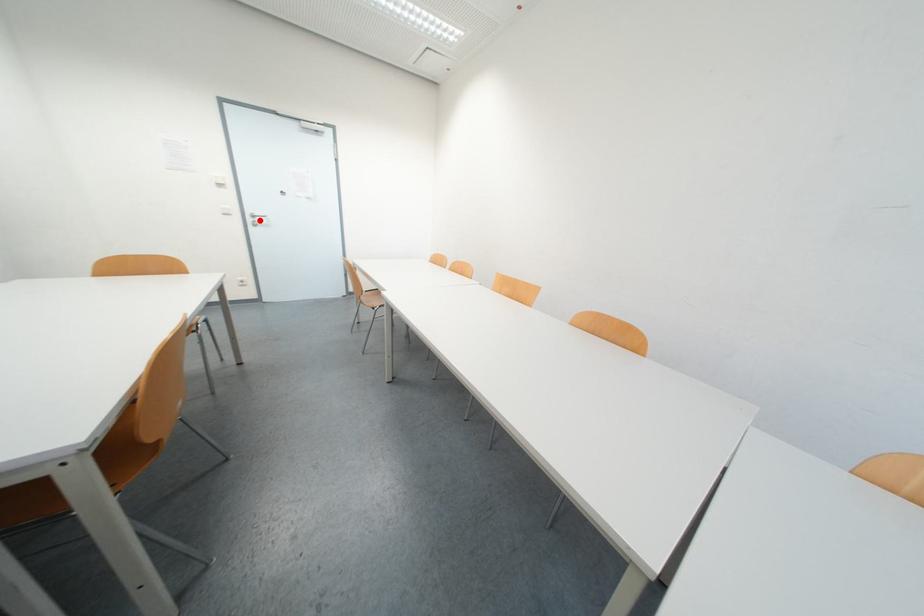
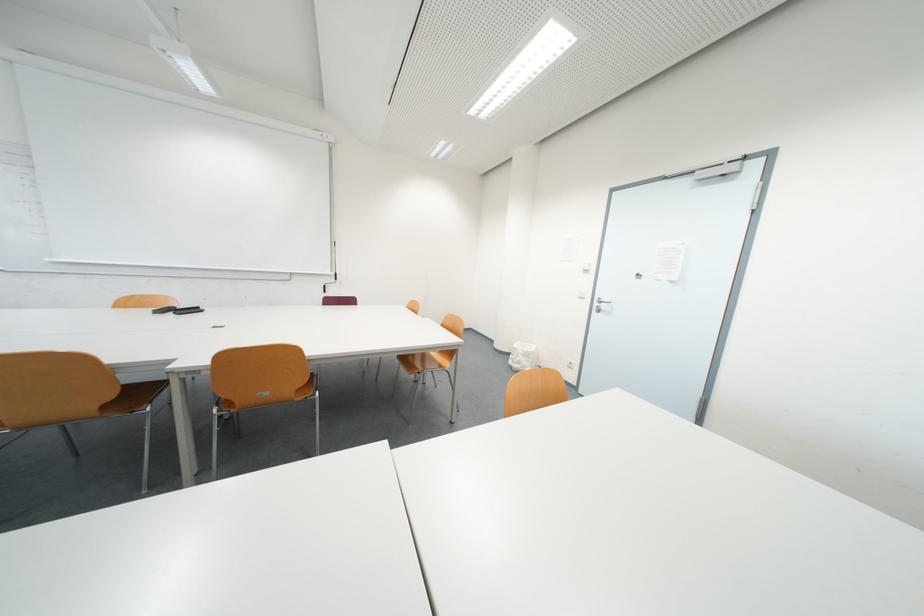
Where in the second image is the point corresponding to the highlighted location from the first image?

(605, 305)